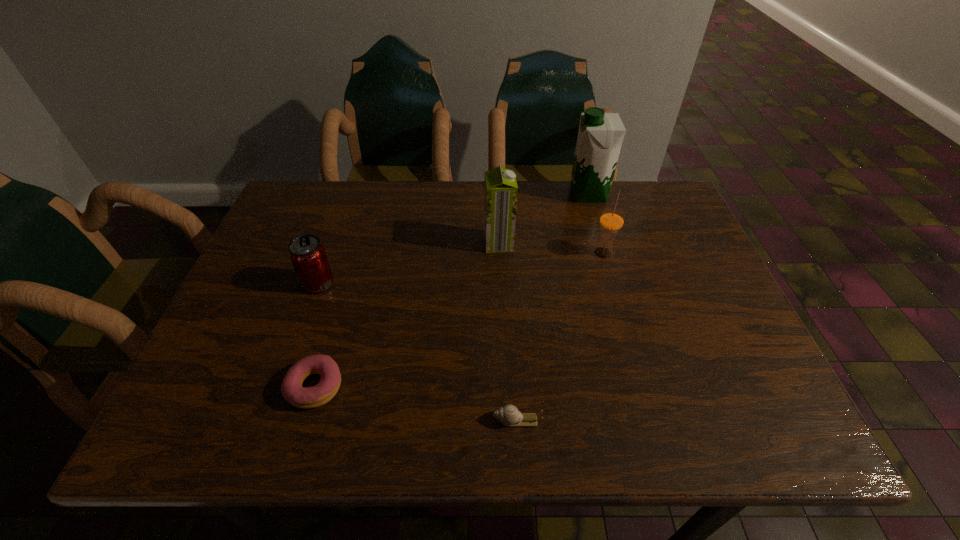
Find the location of `free spot between the third shortest object and the escargot`. free spot between the third shortest object and the escargot is located at coordinates (418, 352).

At what (x,y) coordinates should I click in order to perform the action: click on empty location between the farthest object and the doughnut. Please return your answer as a coordinate pair (x, y). Looking at the image, I should click on (452, 290).

What are the coordinates of `vacant point located between the fourth shortest object and the doughnut` in the screenshot? It's located at (459, 319).

The width and height of the screenshot is (960, 540). I want to click on blank region between the fifth shortest object and the doughnut, so click(x=407, y=315).

I want to click on empty location between the pop soda and the doughnut, so click(317, 335).

Where is `vacant point located between the doughnut and the fourth shortest object`? vacant point located between the doughnut and the fourth shortest object is located at coordinates (459, 319).

Find the location of a particular element. vacant point located between the escargot and the fourth tallest object is located at coordinates (418, 352).

Find the location of a particular element. The height and width of the screenshot is (540, 960). vacant point located between the fourth tallest object and the shorter soya milk is located at coordinates (409, 264).

You are a GUI agent. You are given a task and a screenshot of the screen. Output one action in this format:
    pyautogui.click(x=<x>, y=<y>)
    Task: Click on the empty space between the escargot and the fourth farthest object
    
    Given the screenshot: What is the action you would take?
    pyautogui.click(x=418, y=352)

The image size is (960, 540). In order to click on object that is the closest to the fourth tallest object in this screenshot , I will do `click(302, 397)`.